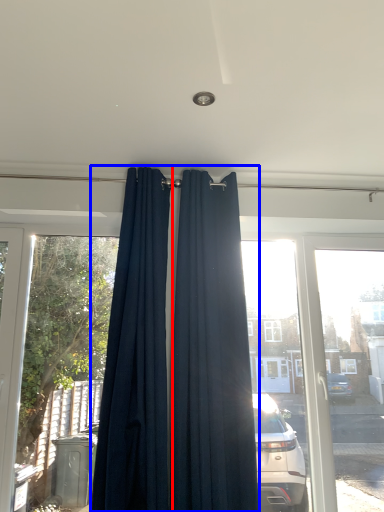
Question: Among these objects, which one is nearest to the camera, curtain (highlighted by a red box) or curtain (highlighted by a blue box)?

Choices:
 (A) curtain
 (B) curtain

Answer: (A)